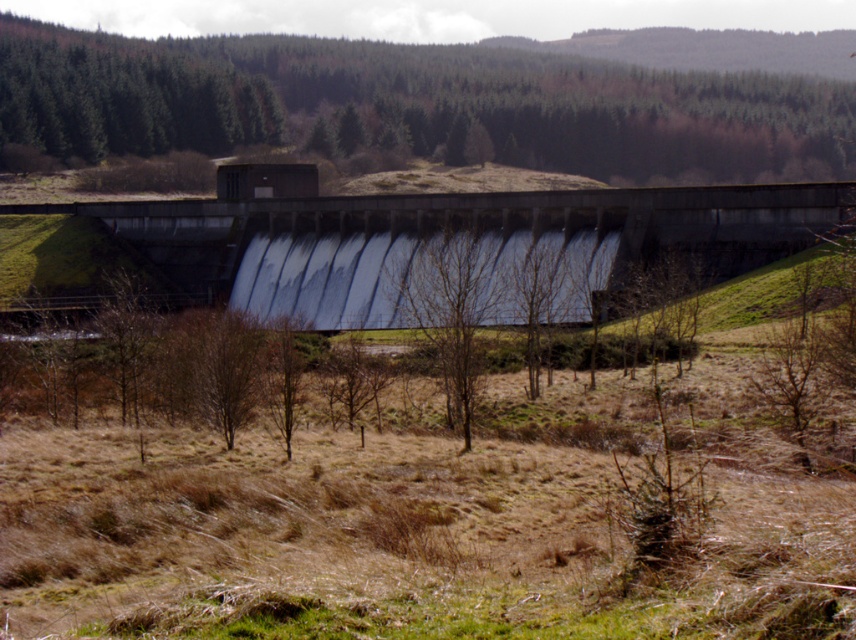
Question: Which object is positioned farthest from the concrete dam at center?

Choices:
 (A) bare wood tree at center
 (B) brown leafless tree at center
 (C) white smooth water at center

Answer: (B)

Question: Is the position of green leafy tree at upper center more distant than that of bare wood tree at center?

Choices:
 (A) yes
 (B) no

Answer: (A)

Question: Which point is closer to the camera?

Choices:
 (A) (282, 358)
 (B) (215, 376)
 (C) (345, 250)
 (D) (215, 291)

Answer: (A)

Question: Which point appears farthest from the camera in this image?

Choices:
 (A) (277, 380)
 (B) (440, 100)
 (C) (278, 273)
 (D) (238, 394)

Answer: (B)

Question: Does green leafy tree at upper center appear over concrete dam at center?

Choices:
 (A) yes
 (B) no

Answer: (A)

Question: Observing the image, what is the correct spatial positioning of white smooth water at center in reference to bare wood tree at center?

Choices:
 (A) right
 (B) left

Answer: (B)